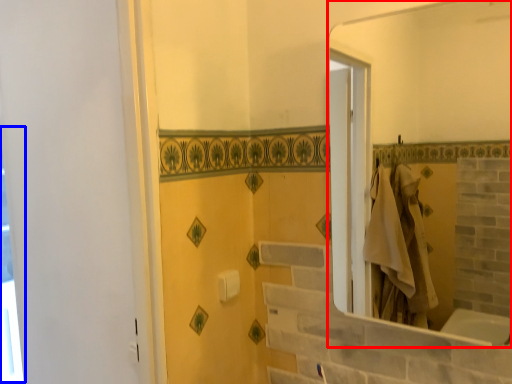
Question: Which object is further to the camera taking this photo, mirror (highlighted by a red box) or window (highlighted by a blue box)?

Choices:
 (A) mirror
 (B) window

Answer: (B)